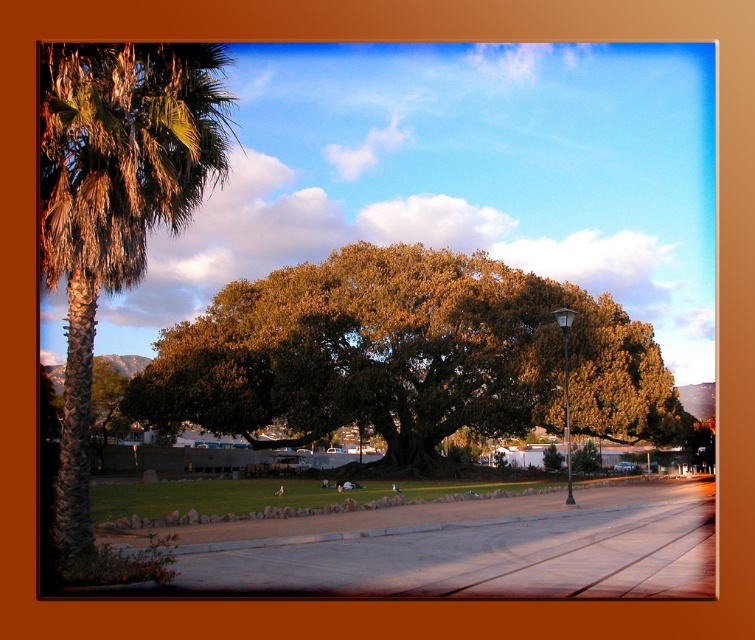
Question: Can you confirm if green leafy oak at center is positioned to the left of green leafy palm at left?

Choices:
 (A) yes
 (B) no

Answer: (B)

Question: Does green leafy oak at center appear under green leafy palm at left?

Choices:
 (A) yes
 (B) no

Answer: (A)

Question: Which of the following is the closest to the observer?

Choices:
 (A) green leafy palm at left
 (B) green leafy oak at center

Answer: (A)

Question: Which point is closer to the camera?

Choices:
 (A) green leafy palm at left
 (B) green leafy oak at center

Answer: (A)

Question: Is green leafy oak at center to the left of green leafy palm at left from the viewer's perspective?

Choices:
 (A) yes
 (B) no

Answer: (B)